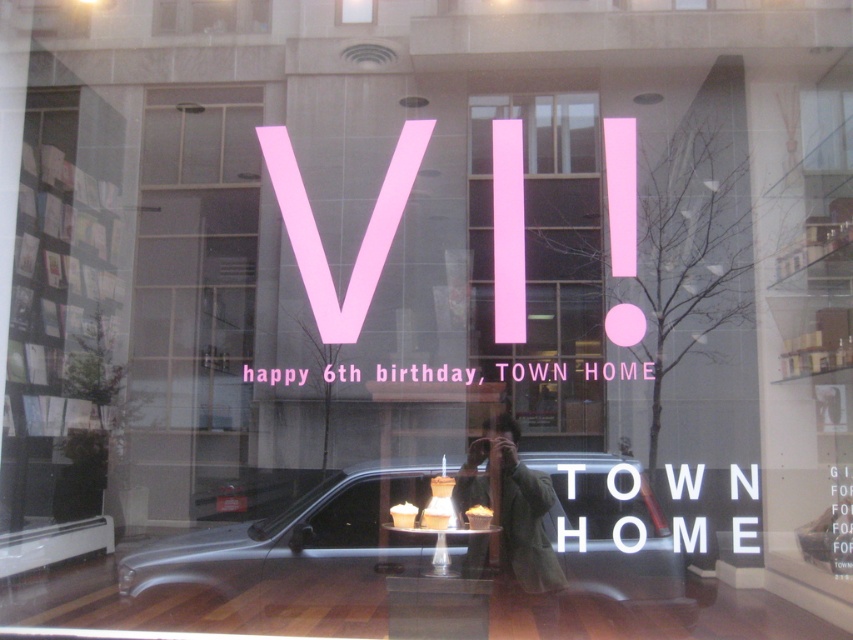
You are a delivery person who needs to place a new rectangular box that is 1.2 meters wide into the store window display. The box must be placed between the silver metallic car at center and the pink matte sign at center. Based on the current arrangement, can the box fit between them without overlapping either object?

The silver metallic car at center might be wider than pink matte sign at center, so there is uncertainty about the available space between them. Without knowing the exact width difference, it is not possible to confirm if the 1.2 meter wide box will fit between them.

You are a customer standing in front of the store window. You see the silver metallic car at center and the pink matte sign at center. Which object is closer to the left side of the window?

The silver metallic car at center is closer to the left side of the window because it is positioned to the left of the pink matte sign at center.